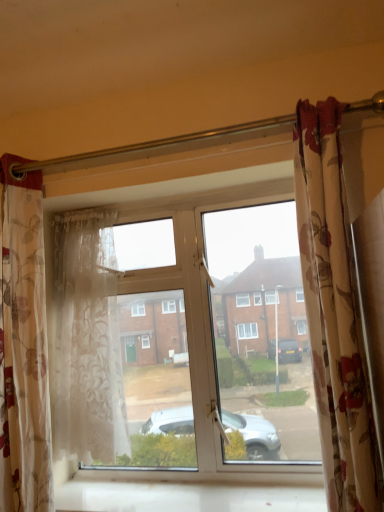
Question: From their relative heights in the image, would you say transparent glass window at center is taller or shorter than translucent floral fabric curtain at left, acting as the first curtain starting from the left?

Choices:
 (A) tall
 (B) short

Answer: (B)

Question: From the image's perspective, is transparent glass window at center above or below translucent floral fabric curtain at left, acting as the first curtain starting from the left?

Choices:
 (A) above
 (B) below

Answer: (B)

Question: Based on their relative distances, which object is nearer to the floral fabric curtain at right, acting as the third curtain starting from the left?

Choices:
 (A) transparent glass window at center
 (B) sheer floral fabric curtain at left, which ranks as the second curtain in left-to-right order
 (C) white smooth window sill at lower center
 (D) translucent floral fabric curtain at left, acting as the first curtain starting from the left

Answer: (A)

Question: Based on their relative distances, which object is farther from the floral fabric curtain at right, the first curtain viewed from the right?

Choices:
 (A) sheer floral fabric curtain at left, which is the second curtain in right-to-left order
 (B) translucent floral fabric curtain at left, acting as the first curtain starting from the left
 (C) white smooth window sill at lower center
 (D) transparent glass window at center

Answer: (B)